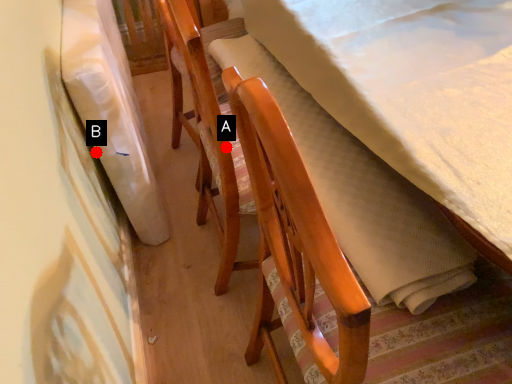
Question: Two points are circled on the image, labeled by A and B beside each circle. Which point is farther to the camera?

Choices:
 (A) A is further
 (B) B is further

Answer: (B)